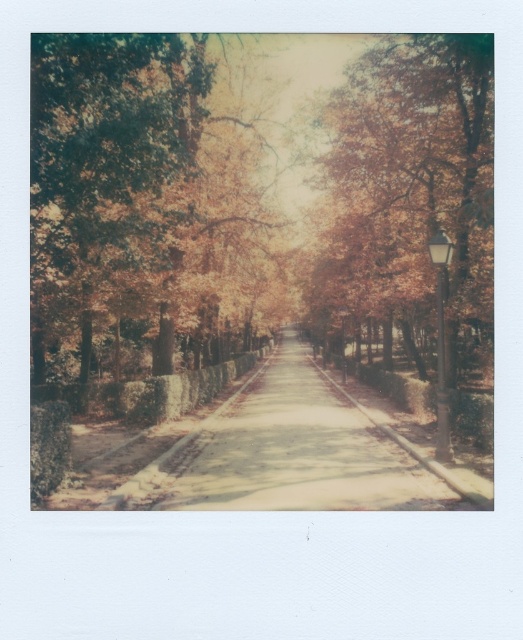
Question: Can you confirm if green textured tree at left is positioned above autumn leaves at center?

Choices:
 (A) no
 (B) yes

Answer: (B)

Question: Observing the image, what is the correct spatial positioning of green textured tree at left in reference to autumn leaves at center?

Choices:
 (A) above
 (B) below

Answer: (A)

Question: Which point is closer to the camera?

Choices:
 (A) (83, 323)
 (B) (430, 214)

Answer: (B)

Question: Is green textured tree at left further to camera compared to autumn leaves at center?

Choices:
 (A) no
 (B) yes

Answer: (A)